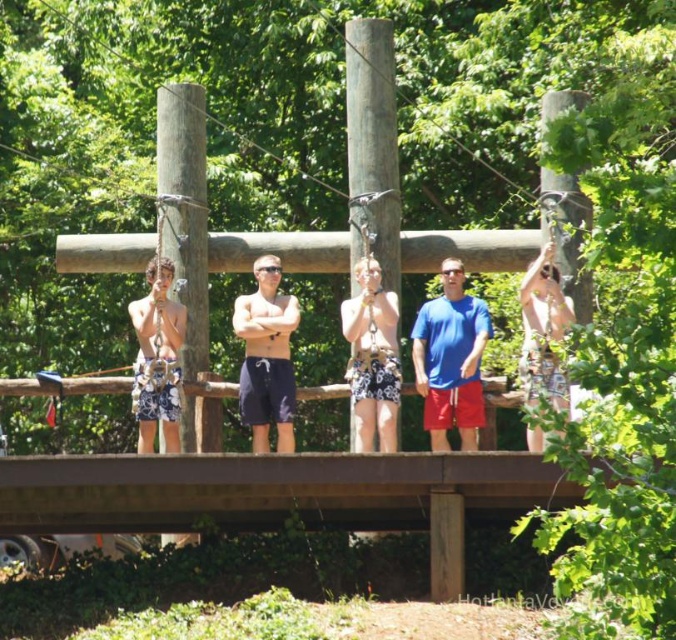
You are a participant on the ropes course platform. You need to grab the blue fabric shirt at center before reaching the smooth wood pole at upper right. Is this possible based on their positions?

The blue fabric shirt at center is below the smooth wood pole at upper right, so you can grab the blue fabric shirt at center first before reaching the smooth wood pole at upper right.

You are standing on the wooden platform and want to reach both the point at position (x=431, y=362) and the point at position (x=562, y=252). Which point will you reach first if you move forward in a straight line?

You will reach the point at position (x=431, y=362) first because it is closer to you than the point at position (x=562, y=252).

You are standing on the wooden platform in the ropes course. There is a blue fabric shirt at center marked by point (x=450, y=358). Can you see the blue fabric shirt at center from your current position on the platform?

Yes, the blue fabric shirt at center is marked by point (x=450, y=358), so it is visible from your current position on the platform.